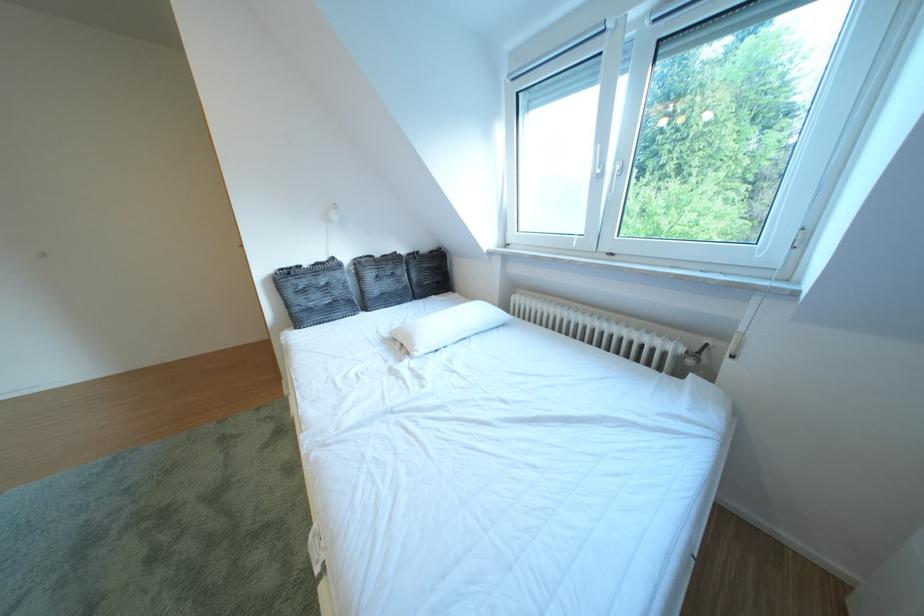
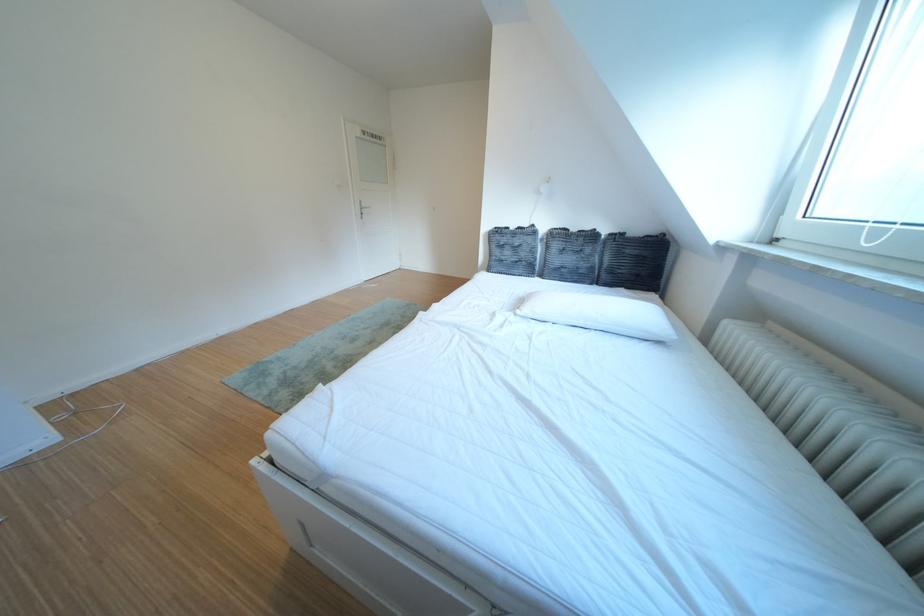
Find the pixel in the second image that matches the point at 434,352 in the first image.

(540, 314)